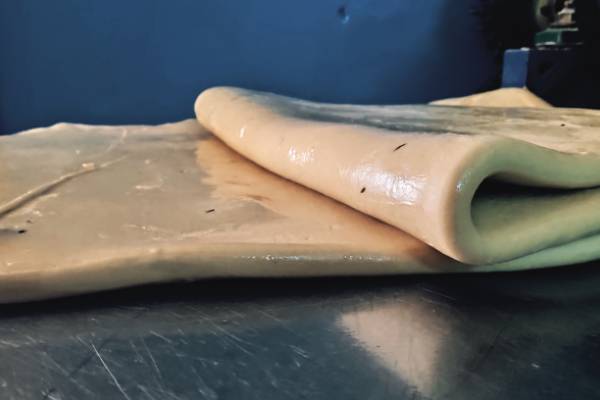
At what (x,y) coordinates should I click in order to perform the action: click on shadow on wall. Please return your answer as a coordinate pair (x, y). The width and height of the screenshot is (600, 400). Looking at the image, I should click on (490, 44).